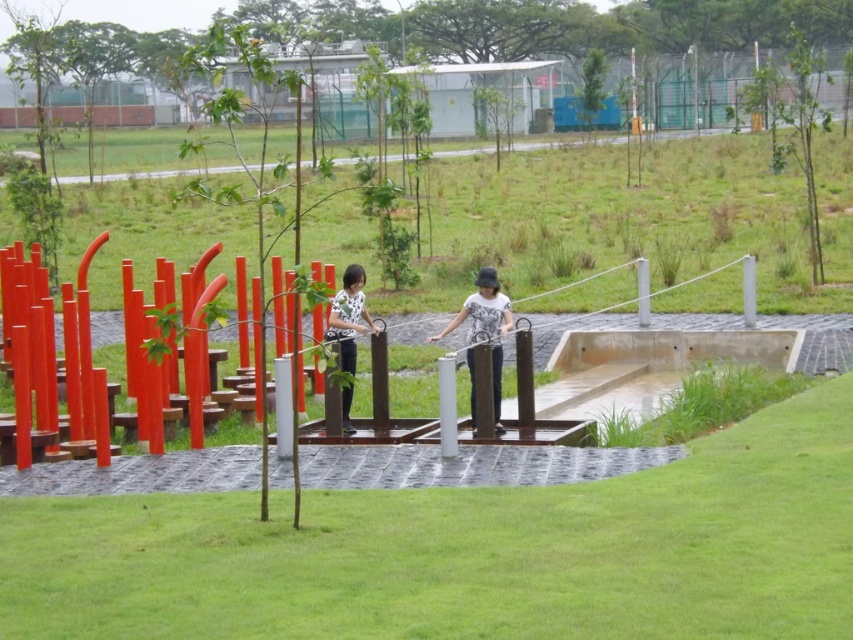
Question: Is white matte shirt at center in front of white dotted shirt at center?

Choices:
 (A) no
 (B) yes

Answer: (B)

Question: Can you confirm if metallic silver rope bridge at center is bigger than white dotted shirt at center?

Choices:
 (A) yes
 (B) no

Answer: (A)

Question: Which object is the farthest from the metallic silver rope bridge at center?

Choices:
 (A) white dotted shirt at center
 (B) white matte shirt at center

Answer: (B)

Question: Is metallic silver rope bridge at center below white matte shirt at center?

Choices:
 (A) no
 (B) yes

Answer: (A)

Question: Among these objects, which one is nearest to the camera?

Choices:
 (A) white dotted shirt at center
 (B) white matte shirt at center
 (C) metallic silver rope bridge at center

Answer: (C)

Question: Which object appears farthest from the camera in this image?

Choices:
 (A) white dotted shirt at center
 (B) metallic silver rope bridge at center
 (C) white matte shirt at center

Answer: (A)